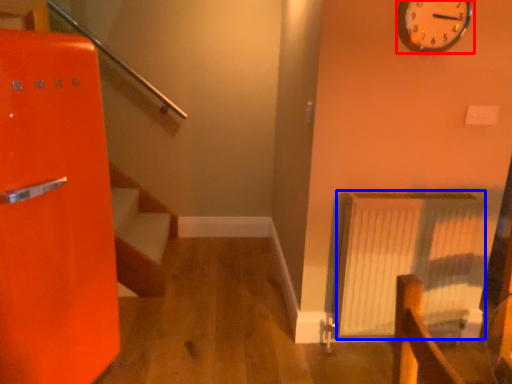
Question: Which of the following is the farthest to the observer, wall clock (highlighted by a red box) or radiator (highlighted by a blue box)?

Choices:
 (A) wall clock
 (B) radiator

Answer: (B)